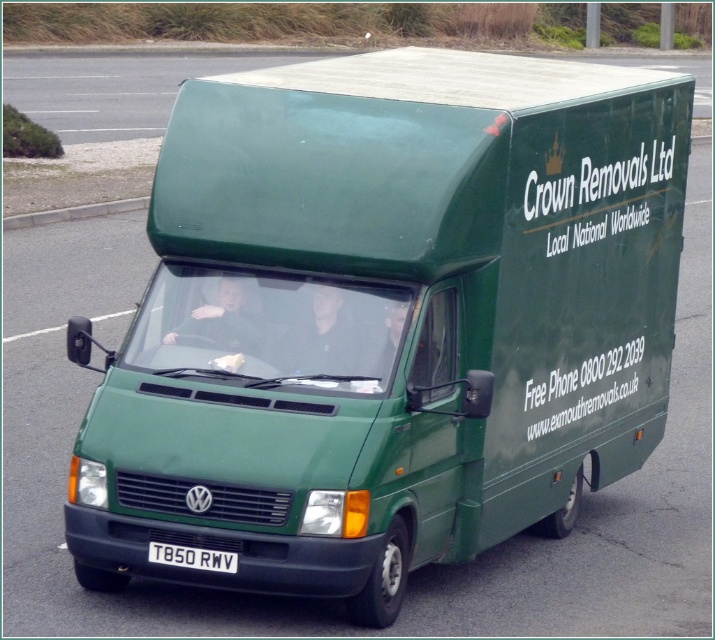
Question: From the image, what is the correct spatial relationship of gray concrete curb at left in relation to white plastic license plate at center?

Choices:
 (A) right
 (B) left

Answer: (B)

Question: Does gray concrete curb at left appear under white plastic license plate at center?

Choices:
 (A) no
 (B) yes

Answer: (A)

Question: Is gray concrete curb at left to the right of white plastic license plate at center from the viewer's perspective?

Choices:
 (A) yes
 (B) no

Answer: (B)

Question: Which point is closer to the camera?

Choices:
 (A) (143, 205)
 (B) (167, 548)

Answer: (B)

Question: Which of the following is the farthest from the observer?

Choices:
 (A) (9, 228)
 (B) (220, 568)

Answer: (A)